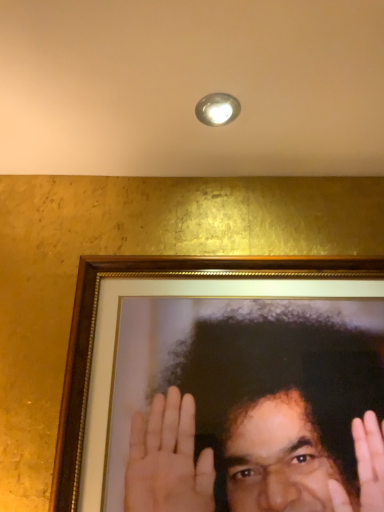
This screenshot has width=384, height=512. What are the coordinates of `metallic dome at upper center` in the screenshot? It's located at (217, 109).

What is the approximate height of metallic dome at upper center?

metallic dome at upper center is 0.50 inches tall.

Describe the element at coordinates (217, 109) in the screenshot. I see `metallic dome at upper center` at that location.

Describe the element at coordinates (296, 458) in the screenshot. I see `smooth gold frame at center` at that location.

Image resolution: width=384 pixels, height=512 pixels. In order to click on smooth gold frame at center in this screenshot , I will do `click(296, 458)`.

Identify the location of metallic dome at upper center. Image resolution: width=384 pixels, height=512 pixels. (217, 109).

Between metallic dome at upper center and smooth gold frame at center, which one appears on the left side from the viewer's perspective?

From the viewer's perspective, metallic dome at upper center appears more on the left side.

Is metallic dome at upper center in front of or behind smooth gold frame at center in the image?

In the image, metallic dome at upper center appears behind smooth gold frame at center.

Considering the positions of point (237, 112) and point (135, 464), is point (237, 112) closer or farther from the camera than point (135, 464)?

Clearly, point (237, 112) is more distant from the camera than point (135, 464).

From the image's perspective, which object appears higher, metallic dome at upper center or smooth gold frame at center?

metallic dome at upper center is shown above in the image.

From a real-world perspective, is metallic dome at upper center above or below smooth gold frame at center?

From a real-world perspective, metallic dome at upper center is physically above smooth gold frame at center.

Considering the relative sizes of metallic dome at upper center and smooth gold frame at center in the image provided, is metallic dome at upper center wider than smooth gold frame at center?

Correct, the width of metallic dome at upper center exceeds that of smooth gold frame at center.

Can you confirm if metallic dome at upper center is taller than smooth gold frame at center?

No, metallic dome at upper center is not taller than smooth gold frame at center.

In terms of size, does metallic dome at upper center appear bigger or smaller than smooth gold frame at center?

In the image, metallic dome at upper center appears to be smaller than smooth gold frame at center.

Is metallic dome at upper center completely or partially outside of smooth gold frame at center?

Yes, metallic dome at upper center is located beyond the bounds of smooth gold frame at center.

Is the surface of metallic dome at upper center in direct contact with smooth gold frame at center?

They are not placed beside each other.

Could you tell me if metallic dome at upper center is turned towards smooth gold frame at center?

No, metallic dome at upper center does not turn towards smooth gold frame at center.

How many degrees apart are the facing directions of metallic dome at upper center and smooth gold frame at center?

They differ by 6.04 degrees in their facing directions.

How much distance is there between metallic dome at upper center and smooth gold frame at center?

They are 67.41 centimeters apart.

Locate an element on the screen. This screenshot has width=384, height=512. man on the right side of metallic dome at upper center is located at coordinates (x=296, y=458).

Between smooth gold frame at center and metallic dome at upper center, which one appears on the right side from the viewer's perspective?

From the viewer's perspective, smooth gold frame at center appears more on the right side.

Considering the relative positions of smooth gold frame at center and metallic dome at upper center in the image provided, is smooth gold frame at center behind metallic dome at upper center?

No, it is in front of metallic dome at upper center.

Is point (251, 469) more distant than point (231, 111)?

No, (251, 469) is in front of (231, 111).

From the image's perspective, is smooth gold frame at center under metallic dome at upper center?

Yes.

From a real-world perspective, is smooth gold frame at center beneath metallic dome at upper center?

Yes, from a real-world perspective, smooth gold frame at center is below metallic dome at upper center.

Which object is thinner, smooth gold frame at center or metallic dome at upper center?

smooth gold frame at center is thinner.

Consider the image. Considering the relative sizes of smooth gold frame at center and metallic dome at upper center in the image provided, is smooth gold frame at center shorter than metallic dome at upper center?

Incorrect, the height of smooth gold frame at center does not fall short of that of metallic dome at upper center.

Who is bigger, smooth gold frame at center or metallic dome at upper center?

Bigger between the two is smooth gold frame at center.

From the picture: Is smooth gold frame at center positioned beyond the bounds of metallic dome at upper center?

Yes, smooth gold frame at center is not within metallic dome at upper center.

In the scene shown: Are smooth gold frame at center and metallic dome at upper center located far from each other?

smooth gold frame at center is near metallic dome at upper center, not far away.

Is metallic dome at upper center at the back of smooth gold frame at center?

smooth gold frame at center does not have its back to metallic dome at upper center.

The height and width of the screenshot is (512, 384). What are the coordinates of `light fixture located behind the smooth gold frame at center` in the screenshot? It's located at (217, 109).

Where is `light fixture behind the smooth gold frame at center`? The width and height of the screenshot is (384, 512). light fixture behind the smooth gold frame at center is located at coordinates point(217,109).

Identify the location of light fixture that appears on the left of smooth gold frame at center. The width and height of the screenshot is (384, 512). click(217, 109).